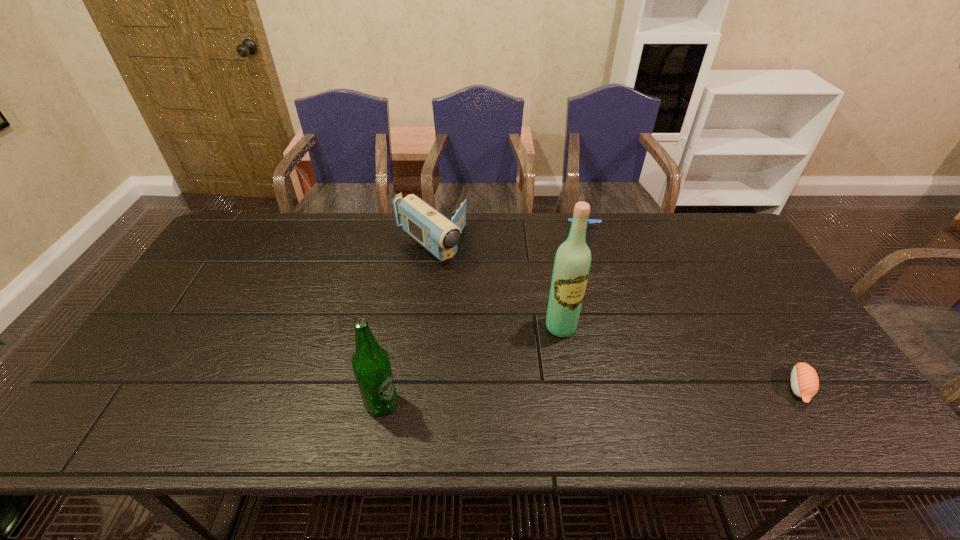
Find the location of `free location that satisfies the following two spatial constraints: 1. on the front side of the shortest object; 2. on the left side of the second shortest object`. free location that satisfies the following two spatial constraints: 1. on the front side of the shortest object; 2. on the left side of the second shortest object is located at coordinates (629, 388).